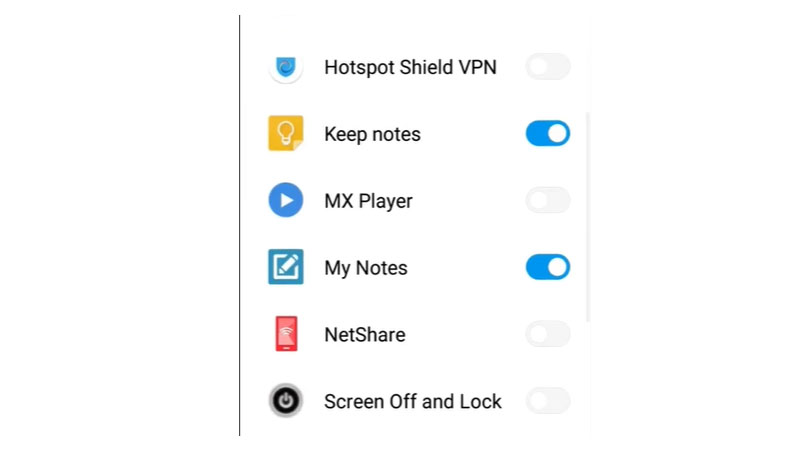
Find the location of a particular element. The image size is (800, 450). yellow square, light bulb is located at coordinates (285, 137).